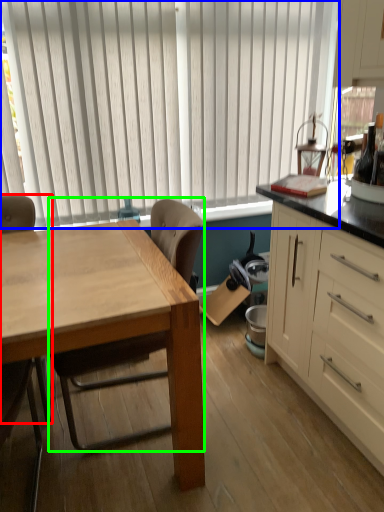
Question: Which object is positioned closest to chair (highlighted by a red box)? Select from window blind (highlighted by a blue box) and chair (highlighted by a green box).

Choices:
 (A) window blind
 (B) chair

Answer: (B)